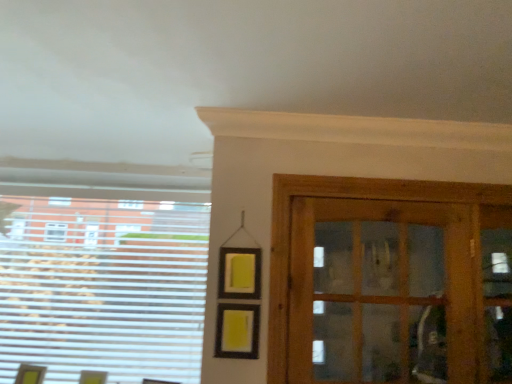
Locate an element on the screen. The width and height of the screenshot is (512, 384). white plastic blinds at left is located at coordinates (103, 286).

What do you see at coordinates (103, 286) in the screenshot?
I see `white plastic blinds at left` at bounding box center [103, 286].

Describe the element at coordinates (380, 293) in the screenshot. I see `wooden cabinet at right` at that location.

Image resolution: width=512 pixels, height=384 pixels. What are the coordinates of `wooden cabinet at right` in the screenshot? It's located at (380, 293).

This screenshot has height=384, width=512. What are the coordinates of `white plastic blinds at left` in the screenshot? It's located at (103, 286).

Between white plastic blinds at left and wooden cabinet at right, which one appears on the left side from the viewer's perspective?

From the viewer's perspective, white plastic blinds at left appears more on the left side.

Is the position of white plastic blinds at left less distant than that of wooden cabinet at right?

No, the depth of white plastic blinds at left is greater than that of wooden cabinet at right.

Is point (50, 343) closer or farther from the camera than point (422, 366)?

Point (50, 343) is positioned farther from the camera compared to point (422, 366).

From the image's perspective, is white plastic blinds at left located above wooden cabinet at right?

No, from the image's perspective, white plastic blinds at left is not over wooden cabinet at right.

From a real-world perspective, is white plastic blinds at left located higher than wooden cabinet at right?

Incorrect, from a real-world perspective, white plastic blinds at left is lower than wooden cabinet at right.

Considering the relative sizes of white plastic blinds at left and wooden cabinet at right in the image provided, is white plastic blinds at left thinner than wooden cabinet at right?

Yes.

Which of these two, white plastic blinds at left or wooden cabinet at right, stands taller?

With more height is white plastic blinds at left.

Who is bigger, white plastic blinds at left or wooden cabinet at right?

Bigger between the two is wooden cabinet at right.

Looking at this image, is white plastic blinds at left inside or outside of wooden cabinet at right?

white plastic blinds at left is outside wooden cabinet at right.

Is white plastic blinds at left touching wooden cabinet at right?

No, white plastic blinds at left is not beside wooden cabinet at right.

Is white plastic blinds at left positioned with its back to wooden cabinet at right?

No, white plastic blinds at left's orientation is not away from wooden cabinet at right.

How different are the orientations of white plastic blinds at left and wooden cabinet at right in degrees?

0.451 degrees.

Measure the distance from white plastic blinds at left to wooden cabinet at right.

5.41 feet.

Identify the location of window below the wooden cabinet at right (from a real-world perspective). The height and width of the screenshot is (384, 512). (103, 286).

Considering the relative positions of wooden cabinet at right and white plastic blinds at left in the image provided, is wooden cabinet at right to the left of white plastic blinds at left from the viewer's perspective?

Incorrect, wooden cabinet at right is not on the left side of white plastic blinds at left.

Between wooden cabinet at right and white plastic blinds at left, which one is positioned in front?

wooden cabinet at right is closer to the camera.

Is point (326, 231) closer to camera compared to point (163, 357)?

No, it is behind (163, 357).

From the image's perspective, is wooden cabinet at right located above or below white plastic blinds at left?

Based on their image positions, wooden cabinet at right is located above white plastic blinds at left.

From a real-world perspective, is wooden cabinet at right physically above white plastic blinds at left?

Correct, in the physical world, wooden cabinet at right is higher than white plastic blinds at left.

Based on the photo, considering the sizes of objects wooden cabinet at right and white plastic blinds at left in the image provided, who is wider, wooden cabinet at right or white plastic blinds at left?

wooden cabinet at right.

Is wooden cabinet at right taller than white plastic blinds at left?

No, wooden cabinet at right is not taller than white plastic blinds at left.

Is wooden cabinet at right smaller than white plastic blinds at left?

Actually, wooden cabinet at right might be larger than white plastic blinds at left.

Is white plastic blinds at left a part of wooden cabinet at right?

No.

Is wooden cabinet at right far from white plastic blinds at left?

Absolutely, wooden cabinet at right is distant from white plastic blinds at left.

Is wooden cabinet at right oriented towards white plastic blinds at left?

No, wooden cabinet at right is not facing towards white plastic blinds at left.

How different are the orientations of wooden cabinet at right and white plastic blinds at left in degrees?

There is a 0.451-degree angle between the facing directions of wooden cabinet at right and white plastic blinds at left.

Where is `door that is on the right side of white plastic blinds at left`? door that is on the right side of white plastic blinds at left is located at coordinates (380, 293).

Locate an element on the screen. The height and width of the screenshot is (384, 512). window on the left of wooden cabinet at right is located at coordinates (103, 286).

Identify the location of door that is on the right side of white plastic blinds at left. (380, 293).